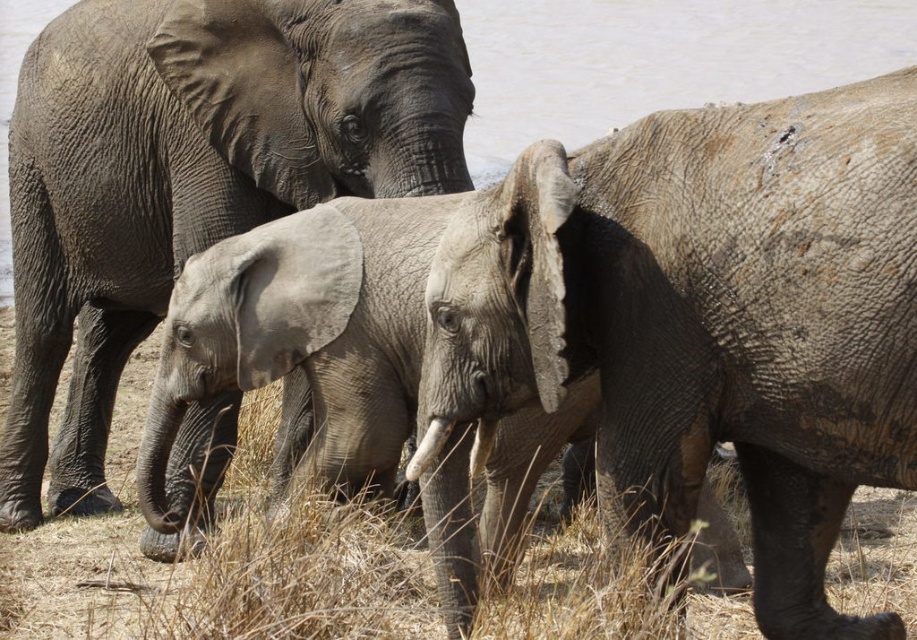
Who is taller, gray rough elephant at center or gray matte elephant at center?

gray matte elephant at center is taller.

Can you confirm if gray rough elephant at center is shorter than gray matte elephant at center?

Yes, gray rough elephant at center is shorter than gray matte elephant at center.

Image resolution: width=917 pixels, height=640 pixels. Identify the location of gray rough elephant at center. (706, 317).

Identify the location of gray rough elephant at center. This screenshot has height=640, width=917. (706, 317).

Between gray matte elephant at center and gray water at upper center, which one has less height?

gray water at upper center is shorter.

In the scene shown: Who is taller, gray matte elephant at center or gray water at upper center?

Standing taller between the two is gray matte elephant at center.

Which is in front, point (21, 344) or point (637, 74)?

Point (21, 344)

Where is `gray matte elephant at center`? gray matte elephant at center is located at coordinates (191, 177).

Which of these two, gray rough elephant at center or gray water at upper center, stands shorter?

gray water at upper center is shorter.

Who is more distant from viewer, (783, 170) or (671, 84)?

Point (671, 84)

Is point (869, 236) closer to camera compared to point (619, 16)?

Yes, it is.

The image size is (917, 640). In order to click on gray rough elephant at center in this screenshot , I will do (x=706, y=317).